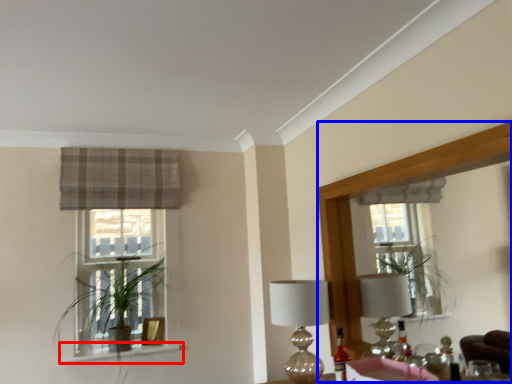
Question: Which point is closer to the camera, window sill (highlighted by a red box) or mirror (highlighted by a blue box)?

Choices:
 (A) window sill
 (B) mirror

Answer: (B)